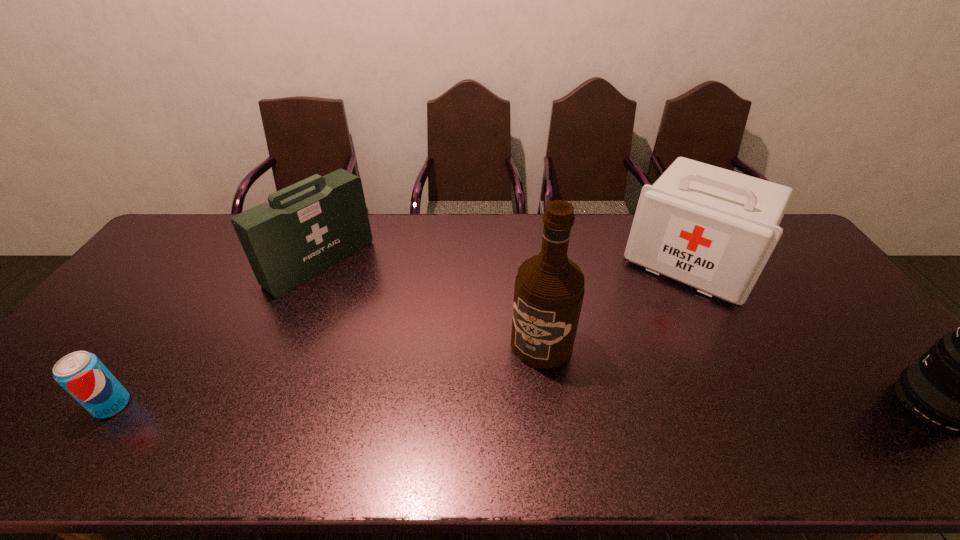
I want to click on free space on the desktop that is between the leftmost object and the rightmost object and is positioned on the front-facing side of the left first-aid kit, so click(x=518, y=405).

The height and width of the screenshot is (540, 960). I want to click on vacant space on the desktop that is between the leftmost object and the fourth tallest object and is positioned on the front-facing side of the right first-aid kit, so click(x=601, y=405).

You are a GUI agent. You are given a task and a screenshot of the screen. Output one action in this format:
    pyautogui.click(x=<x>, y=<y>)
    Task: Click on the vacant space on the desktop that is between the shortest object and the second shortest object and is positioned on the label of the tallest object
    
    Given the screenshot: What is the action you would take?
    pyautogui.click(x=501, y=405)